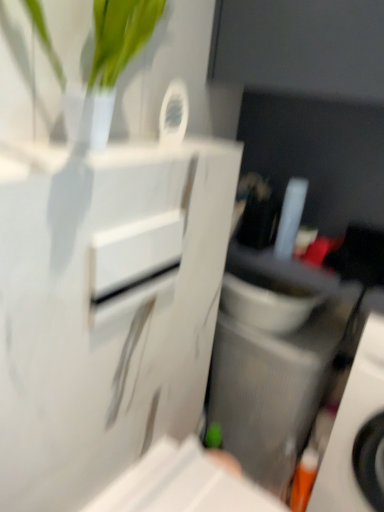
Question: Can you confirm if gray textured speaker at lower right is positioned to the right of orange plastic toothbrush at lower right?

Choices:
 (A) yes
 (B) no

Answer: (B)

Question: Considering the relative sizes of gray textured speaker at lower right and orange plastic toothbrush at lower right in the image provided, is gray textured speaker at lower right thinner than orange plastic toothbrush at lower right?

Choices:
 (A) yes
 (B) no

Answer: (A)

Question: Does gray textured speaker at lower right have a greater width compared to orange plastic toothbrush at lower right?

Choices:
 (A) yes
 (B) no

Answer: (B)

Question: Does gray textured speaker at lower right contain orange plastic toothbrush at lower right?

Choices:
 (A) no
 (B) yes

Answer: (A)

Question: Is gray textured speaker at lower right at the left side of orange plastic toothbrush at lower right?

Choices:
 (A) no
 (B) yes

Answer: (B)

Question: Is gray textured speaker at lower right wider or thinner than white glossy drawer at center?

Choices:
 (A) wide
 (B) thin

Answer: (A)

Question: In terms of height, does gray textured speaker at lower right look taller or shorter compared to white glossy drawer at center?

Choices:
 (A) short
 (B) tall

Answer: (B)

Question: Is gray textured speaker at lower right bigger or smaller than white glossy drawer at center?

Choices:
 (A) big
 (B) small

Answer: (A)

Question: Is point (286, 360) closer or farther from the camera than point (112, 233)?

Choices:
 (A) closer
 (B) farther

Answer: (B)

Question: In terms of height, does white glossy drawer at center look taller or shorter compared to orange plastic toothbrush at lower right?

Choices:
 (A) tall
 (B) short

Answer: (B)

Question: Considering the positions of white glossy drawer at center and orange plastic toothbrush at lower right in the image, is white glossy drawer at center wider or thinner than orange plastic toothbrush at lower right?

Choices:
 (A) thin
 (B) wide

Answer: (A)

Question: Is white glossy drawer at center bigger or smaller than orange plastic toothbrush at lower right?

Choices:
 (A) small
 (B) big

Answer: (A)

Question: From a real-world perspective, is white glossy drawer at center physically located above or below orange plastic toothbrush at lower right?

Choices:
 (A) below
 (B) above

Answer: (B)

Question: Is orange plastic toothbrush at lower right wider or thinner than white glossy drawer at center?

Choices:
 (A) thin
 (B) wide

Answer: (B)

Question: In terms of height, does orange plastic toothbrush at lower right look taller or shorter compared to white glossy drawer at center?

Choices:
 (A) short
 (B) tall

Answer: (B)